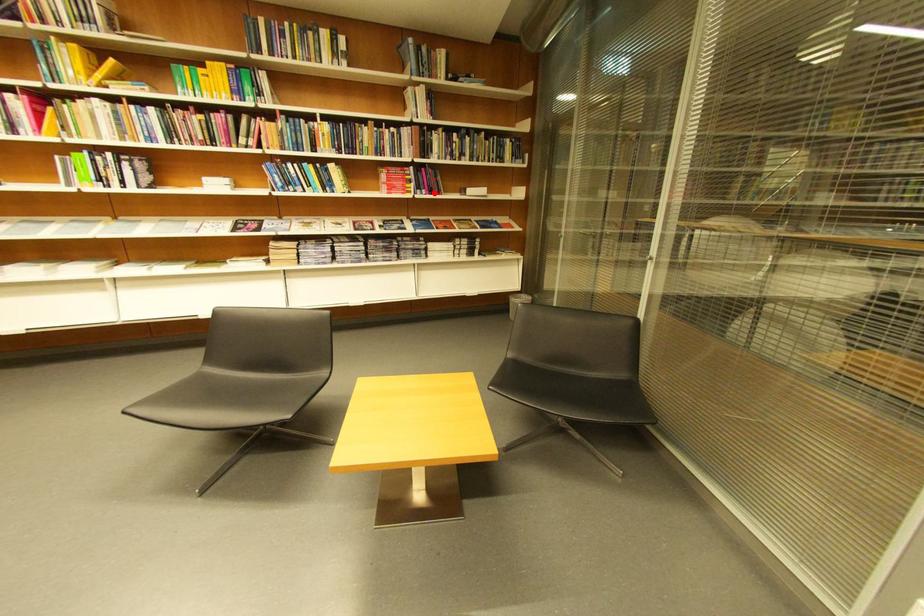
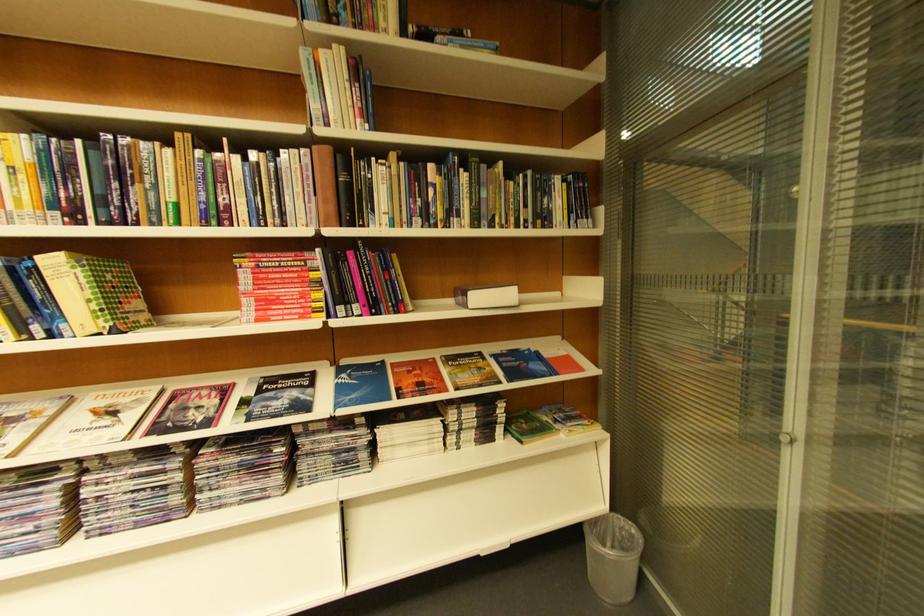
Find the pixel in the second image that matches the highlighted location in the first image.

(367, 310)